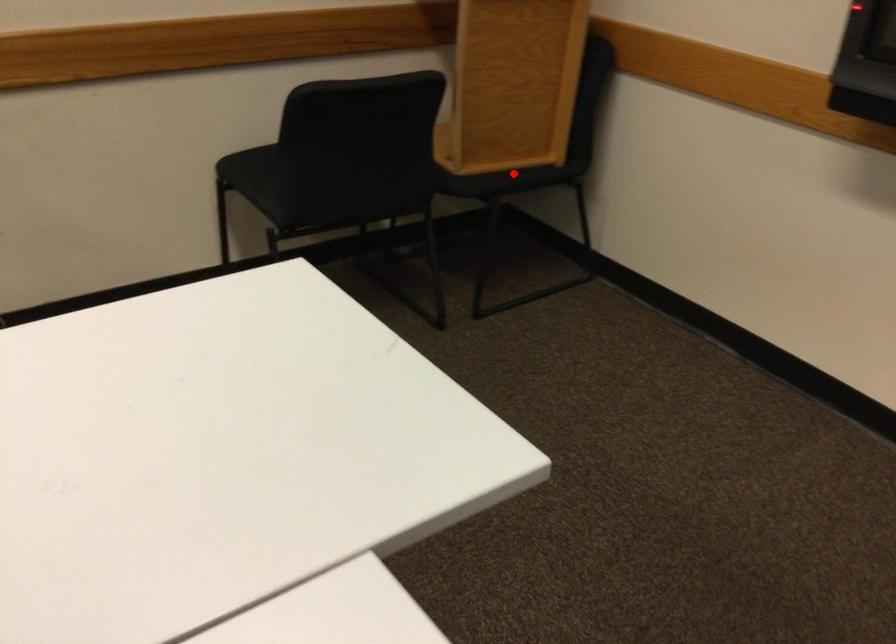
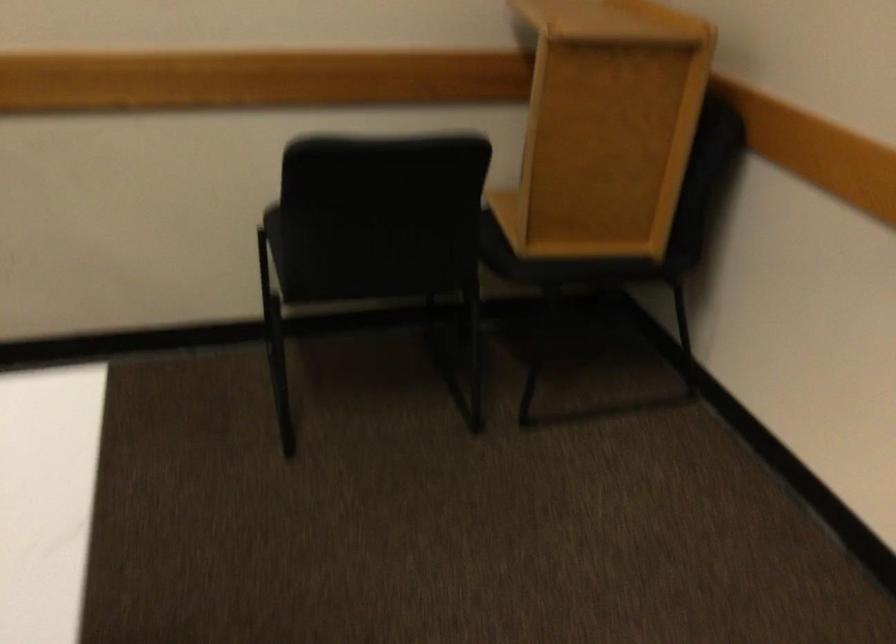
Locate, in the second image, the point that corresponds to the highlighted location in the first image.

(586, 263)